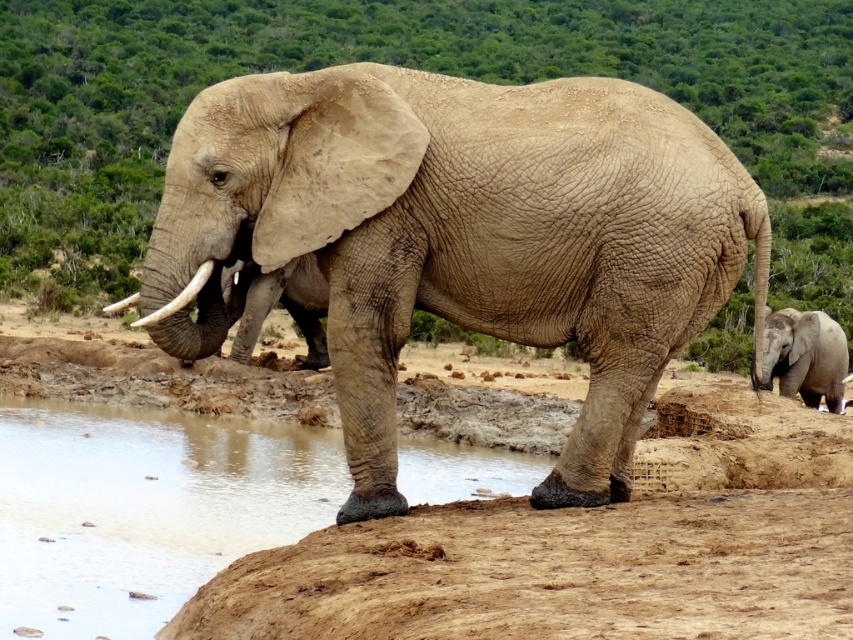
Question: Which object is closer to the camera taking this photo?

Choices:
 (A) brown sandy dirt at lower center
 (B) white matte tusk at left
 (C) clear water at lower left
 (D) rough textured elephant at center

Answer: (A)

Question: Is the position of brown sandy dirt at lower center more distant than that of white ivory tusk at left?

Choices:
 (A) no
 (B) yes

Answer: (A)

Question: Is rough textured elephant at center smaller than white ivory tusk at left?

Choices:
 (A) no
 (B) yes

Answer: (B)

Question: Considering the relative positions of grayish-brown skin baby elephant at lower right and white ivory tusk at left in the image provided, where is grayish-brown skin baby elephant at lower right located with respect to white ivory tusk at left?

Choices:
 (A) above
 (B) below

Answer: (B)

Question: Which object is farther from the camera taking this photo?

Choices:
 (A) white matte tusk at left
 (B) grayish-brown skin baby elephant at lower right
 (C) brown sandy dirt at lower center

Answer: (B)

Question: Based on their relative distances, which object is farther from the white ivory tusk at left?

Choices:
 (A) clear water at lower left
 (B) grayish-brown skin baby elephant at lower right
 (C) rough textured elephant at center
 (D) white matte tusk at left

Answer: (B)